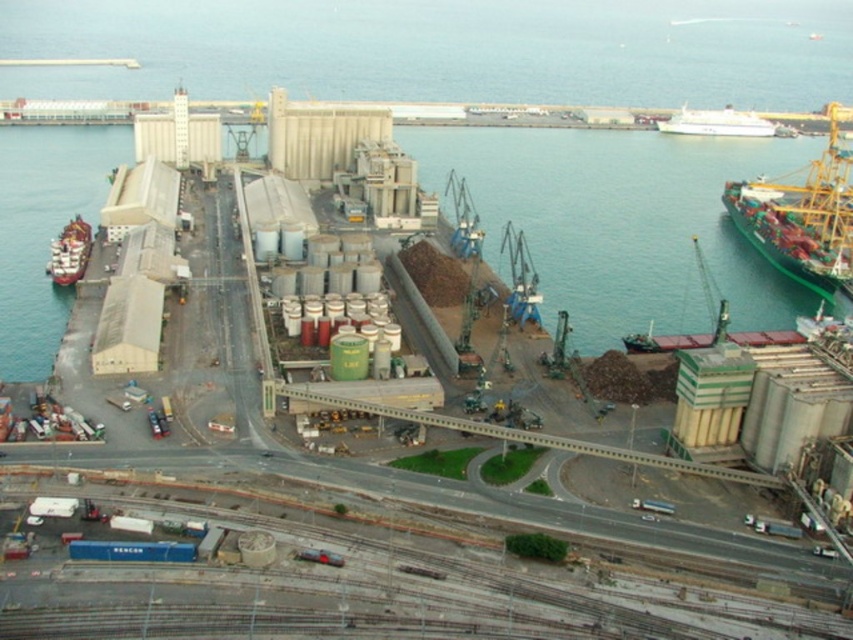
Question: Which point is closer to the camera taking this photo?

Choices:
 (A) (688, 128)
 (B) (85, 253)
 (C) (814, 220)
 (D) (668, 60)

Answer: (B)

Question: Which of the following is the closest to the observer?

Choices:
 (A) white glossy ship at upper right
 (B) green metallic waterway at center

Answer: (B)

Question: Can you confirm if green matte cargo ship at upper right is positioned below white glossy ship at upper right?

Choices:
 (A) no
 (B) yes

Answer: (B)

Question: Observing the image, what is the correct spatial positioning of green matte cargo ship at upper right in reference to white glossy ship at upper right?

Choices:
 (A) above
 (B) below

Answer: (B)

Question: Does green metallic waterway at center appear on the left side of white glossy ship at upper right?

Choices:
 (A) no
 (B) yes

Answer: (B)

Question: Among these points, which one is farthest from the camera?

Choices:
 (A) (82, 269)
 (B) (738, 116)
 (C) (492, 224)

Answer: (B)